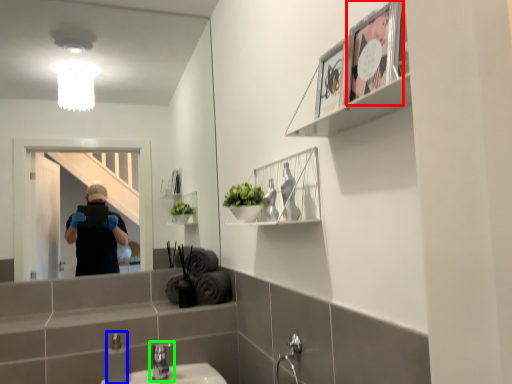
Question: Estimate the real-world distances between objects in this image. Which object is farther from picture frame (highlighted by a red box), toiletry (highlighted by a blue box) or tap (highlighted by a green box)?

Choices:
 (A) toiletry
 (B) tap

Answer: (B)